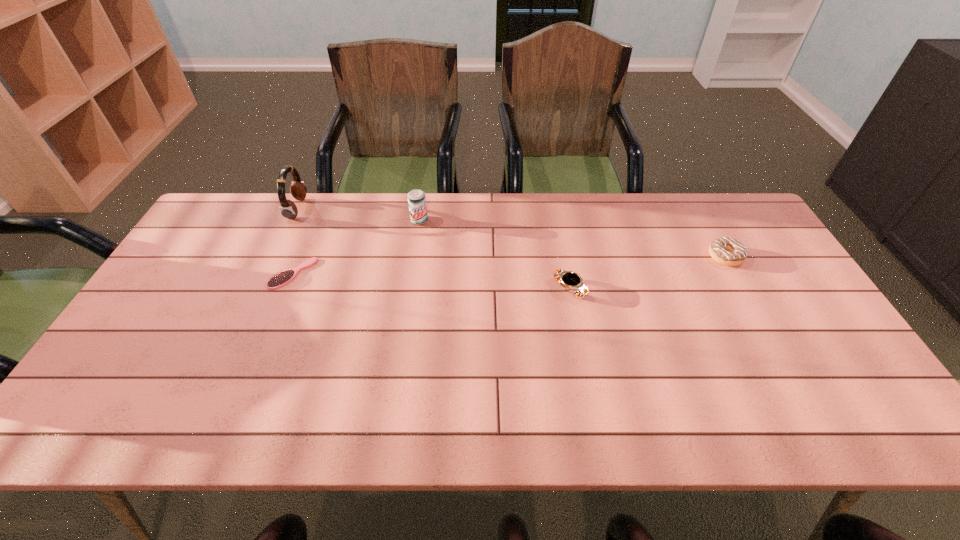
Identify the location of free space that satisfies the following two spatial constraints: 1. on the ear cup of the doughnut; 2. on the right side of the headset. (275, 256).